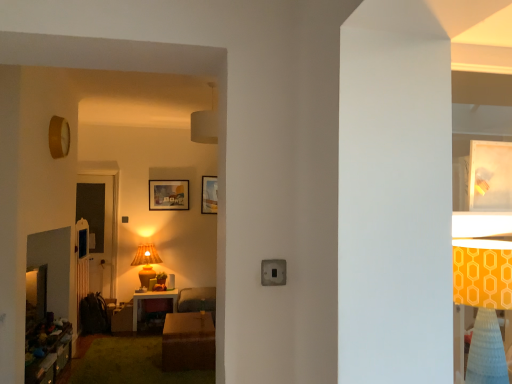
Question: Does matte wooden picture frame at center, which is counted as the third picture frame, starting from the right, have a greater width compared to matte brown table lamp at center?

Choices:
 (A) no
 (B) yes

Answer: (A)

Question: Is matte wooden picture frame at center, the 2th picture frame positioned from the front, at the right side of matte brown table lamp at center?

Choices:
 (A) yes
 (B) no

Answer: (A)

Question: Is matte wooden picture frame at center, which is the 2th picture frame from back to front, closer to the viewer compared to matte brown table lamp at center?

Choices:
 (A) yes
 (B) no

Answer: (B)

Question: Does matte wooden picture frame at center, which is the 1th picture frame in left-to-right order, appear on the left side of matte brown table lamp at center?

Choices:
 (A) no
 (B) yes

Answer: (A)

Question: Is matte wooden picture frame at center, the 2th picture frame positioned from the front, smaller than matte brown table lamp at center?

Choices:
 (A) yes
 (B) no

Answer: (A)

Question: Considering the positions of point (185, 334) and point (481, 198), is point (185, 334) closer or farther from the camera than point (481, 198)?

Choices:
 (A) closer
 (B) farther

Answer: (B)

Question: Is brown wooden table at center, which appears as the 2th table when viewed from the back, inside or outside of matte white picture frame at upper right, the first picture frame from the right?

Choices:
 (A) inside
 (B) outside

Answer: (B)

Question: Based on their positions, is brown wooden table at center, which appears as the 2th table when viewed from the back, located to the left or right of matte white picture frame at upper right, the first picture frame from the right?

Choices:
 (A) left
 (B) right

Answer: (A)

Question: Looking at the image, does brown wooden table at center, the 1th table in the right-to-left sequence, seem bigger or smaller compared to matte white picture frame at upper right, acting as the third picture frame starting from the left?

Choices:
 (A) big
 (B) small

Answer: (A)

Question: From a real-world perspective, relative to matte wooden table at center, arranged as the second table when viewed from the front, is orange fabric lampshade at right vertically above or below?

Choices:
 (A) below
 (B) above

Answer: (B)

Question: Looking at the image, does orange fabric lampshade at right seem bigger or smaller compared to matte wooden table at center, the second table when ordered from right to left?

Choices:
 (A) big
 (B) small

Answer: (B)

Question: From the image's perspective, is orange fabric lampshade at right above or below matte wooden table at center, arranged as the second table when viewed from the front?

Choices:
 (A) below
 (B) above

Answer: (B)

Question: Would you say orange fabric lampshade at right is to the left or to the right of matte wooden table at center, the second table when ordered from right to left, in the picture?

Choices:
 (A) left
 (B) right

Answer: (B)

Question: Would you say matte wooden table at center, the second table when ordered from right to left, is inside or outside metallic silver light switch at center?

Choices:
 (A) outside
 (B) inside

Answer: (A)

Question: In the image, is matte wooden table at center, arranged as the second table when viewed from the front, on the left side or the right side of metallic silver light switch at center?

Choices:
 (A) left
 (B) right

Answer: (A)